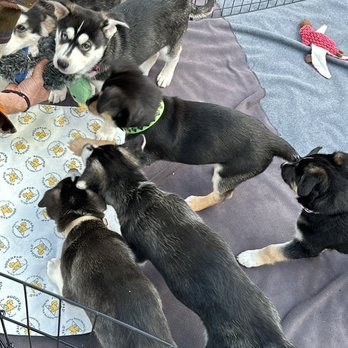
In order to click on light gray blanket in this screenshot , I will do [x=299, y=108].